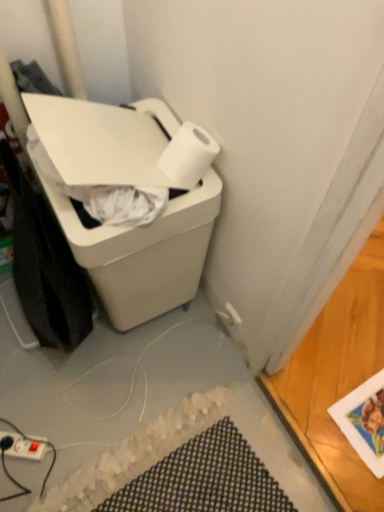
What do you see at coordinates (25, 446) in the screenshot? This screenshot has height=512, width=384. I see `matte white power plugs and sockets at lower left` at bounding box center [25, 446].

What do you see at coordinates (188, 156) in the screenshot? I see `white matte paper towel at upper right` at bounding box center [188, 156].

Image resolution: width=384 pixels, height=512 pixels. I want to click on matte white power plugs and sockets at lower left, so click(25, 446).

How far apart are white plastic trash can at lower left and black textured bath mat at lower center?

A distance of 23.33 inches exists between white plastic trash can at lower left and black textured bath mat at lower center.

Considering the sizes of objects white plastic trash can at lower left and black textured bath mat at lower center in the image provided, who is shorter, white plastic trash can at lower left or black textured bath mat at lower center?

black textured bath mat at lower center.

Looking at this image, is white plastic trash can at lower left located outside black textured bath mat at lower center?

Yes.

Is white plastic trash can at lower left facing away from black textured bath mat at lower center?

No.

Which of these two, black textured bath mat at lower center or white plastic trash can at lower left, stands taller?

white plastic trash can at lower left is taller.

Is black textured bath mat at lower center positioned far away from white plastic trash can at lower left?

Actually, black textured bath mat at lower center and white plastic trash can at lower left are a little close together.

The image size is (384, 512). I want to click on bath mat on the right of white plastic trash can at lower left, so click(204, 479).

From a real-world perspective, who is located lower, black textured bath mat at lower center or white plastic trash can at lower left?

black textured bath mat at lower center, from a real-world perspective.

Between white plastic trash can at lower left and matte white power plugs and sockets at lower left, which one appears on the left side from the viewer's perspective?

matte white power plugs and sockets at lower left.

Can you tell me how much white plastic trash can at lower left and matte white power plugs and sockets at lower left differ in facing direction?

The angular difference between white plastic trash can at lower left and matte white power plugs and sockets at lower left is 144 degrees.

Measure the distance between white plastic trash can at lower left and matte white power plugs and sockets at lower left.

A distance of 27.28 inches exists between white plastic trash can at lower left and matte white power plugs and sockets at lower left.

Considering their positions, is white plastic trash can at lower left located in front of or behind matte white power plugs and sockets at lower left?

white plastic trash can at lower left is in front of matte white power plugs and sockets at lower left.

How many degrees apart are the facing directions of white plastic trash can at lower left and white matte paper towel at upper right?

The facing directions of white plastic trash can at lower left and white matte paper towel at upper right are 0.00136 degrees apart.

Considering the relative sizes of white plastic trash can at lower left and white matte paper towel at upper right in the image provided, is white plastic trash can at lower left bigger than white matte paper towel at upper right?

Correct, white plastic trash can at lower left is larger in size than white matte paper towel at upper right.

Who is shorter, white plastic trash can at lower left or white matte paper towel at upper right?

white matte paper towel at upper right.

Is white plastic trash can at lower left to the left of white matte paper towel at upper right from the viewer's perspective?

Yes, white plastic trash can at lower left is to the left of white matte paper towel at upper right.

Between black textured bath mat at lower center and white matte paper towel at upper right, which one is positioned in front?

white matte paper towel at upper right is in front.

From the image's perspective, which object appears higher, black textured bath mat at lower center or white matte paper towel at upper right?

From the image's view, white matte paper towel at upper right is above.

Considering the relative positions of black textured bath mat at lower center and white matte paper towel at upper right in the image provided, is black textured bath mat at lower center to the left or to the right of white matte paper towel at upper right?

Based on their positions, black textured bath mat at lower center is located to the left of white matte paper towel at upper right.

Between black textured bath mat at lower center and white matte paper towel at upper right, which one has more height?

white matte paper towel at upper right is taller.

Between white matte paper towel at upper right and black textured bath mat at lower center, which one is positioned in front?

Positioned in front is white matte paper towel at upper right.

Based on the photo, how distant is white matte paper towel at upper right from black textured bath mat at lower center?

white matte paper towel at upper right and black textured bath mat at lower center are 30.97 inches apart from each other.

Which is more to the right, white matte paper towel at upper right or black textured bath mat at lower center?

Positioned to the right is white matte paper towel at upper right.

From their relative heights in the image, would you say white matte paper towel at upper right is taller or shorter than black textured bath mat at lower center?

white matte paper towel at upper right is taller than black textured bath mat at lower center.

From the picture: Is black textured bath mat at lower center to the right of matte white power plugs and sockets at lower left from the viewer's perspective?

Yes, black textured bath mat at lower center is to the right of matte white power plugs and sockets at lower left.

In the scene shown: Which of these two, black textured bath mat at lower center or matte white power plugs and sockets at lower left, is bigger?

Bigger between the two is black textured bath mat at lower center.

Are black textured bath mat at lower center and matte white power plugs and sockets at lower left far apart?

No, black textured bath mat at lower center is in close proximity to matte white power plugs and sockets at lower left.

From the picture: Can you confirm if black textured bath mat at lower center is taller than matte white power plugs and sockets at lower left?

In fact, black textured bath mat at lower center may be shorter than matte white power plugs and sockets at lower left.

At what (x,y) coordinates should I click in order to perform the action: click on cardboard box above the black textured bath mat at lower center (from the image's perspective). Please return your answer as a coordinate pair (x, y). Image resolution: width=384 pixels, height=512 pixels. Looking at the image, I should click on (144, 253).

The image size is (384, 512). There is a black textured bath mat at lower center. What are the coordinates of `cardboard box above it (from a real-world perspective)` in the screenshot? It's located at (144, 253).

Looking at the image, which one is located closer to black textured bath mat at lower center, white plastic trash can at lower left or white matte paper towel at upper right?

Based on the image, white plastic trash can at lower left appears to be nearer to black textured bath mat at lower center.

Estimate the real-world distances between objects in this image. Which object is closer to matte white power plugs and sockets at lower left, white matte paper towel at upper right or white plastic trash can at lower left?

white plastic trash can at lower left lies closer to matte white power plugs and sockets at lower left than the other object.

When comparing their distances from black textured bath mat at lower center, does white plastic trash can at lower left or matte white power plugs and sockets at lower left seem further?

white plastic trash can at lower left.

Considering their positions, is white plastic trash can at lower left positioned closer to matte white power plugs and sockets at lower left than white matte paper towel at upper right?

white plastic trash can at lower left.

Considering their positions, is white matte paper towel at upper right positioned closer to black textured bath mat at lower center than matte white power plugs and sockets at lower left?

matte white power plugs and sockets at lower left.

Estimate the real-world distances between objects in this image. Which object is further from white matte paper towel at upper right, matte white power plugs and sockets at lower left or white plastic trash can at lower left?

The object further to white matte paper towel at upper right is matte white power plugs and sockets at lower left.

Which object lies further to the anchor point matte white power plugs and sockets at lower left, black textured bath mat at lower center or white plastic trash can at lower left?

white plastic trash can at lower left is further to matte white power plugs and sockets at lower left.

From the image, which object appears to be nearer to matte white power plugs and sockets at lower left, white matte paper towel at upper right or black textured bath mat at lower center?

black textured bath mat at lower center is positioned closer to the anchor matte white power plugs and sockets at lower left.

Identify the location of power plugs and sockets between white matte paper towel at upper right and black textured bath mat at lower center in the vertical direction. (25, 446).

Image resolution: width=384 pixels, height=512 pixels. Identify the location of power plugs and sockets between white plastic trash can at lower left and black textured bath mat at lower center in the up-down direction. (25, 446).

Identify the location of cardboard box between white matte paper towel at upper right and matte white power plugs and sockets at lower left in the up-down direction. (144, 253).

This screenshot has height=512, width=384. Identify the location of cardboard box between white matte paper towel at upper right and black textured bath mat at lower center in the up-down direction. [144, 253].